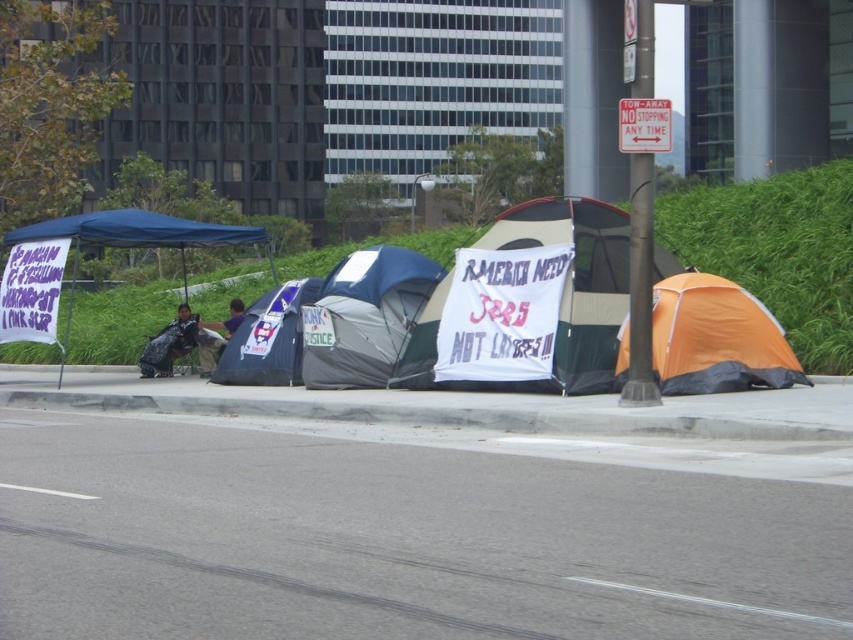
Question: From the image, what is the correct spatial relationship of white fabric tent at center in relation to gray fabric tent at center?

Choices:
 (A) right
 (B) left

Answer: (A)

Question: Can you confirm if gray concrete curb at lower center is positioned above orange fabric tent at right?

Choices:
 (A) no
 (B) yes

Answer: (A)

Question: Which of the following is the farthest from the observer?

Choices:
 (A) orange fabric tent at right
 (B) white plastic sign at center

Answer: (A)

Question: Which of these objects is positioned farthest from the blue fabric tent at center?

Choices:
 (A) orange fabric tent at right
 (B) white fabric tent at center
 (C) gray fabric tent at center

Answer: (A)

Question: Does white fabric tent at center have a smaller size compared to gray fabric tent at center?

Choices:
 (A) no
 (B) yes

Answer: (A)

Question: Which object is the closest to the gray metallic pole at right?

Choices:
 (A) gray concrete curb at lower center
 (B) gray fabric tent at center
 (C) orange fabric tent at right

Answer: (C)